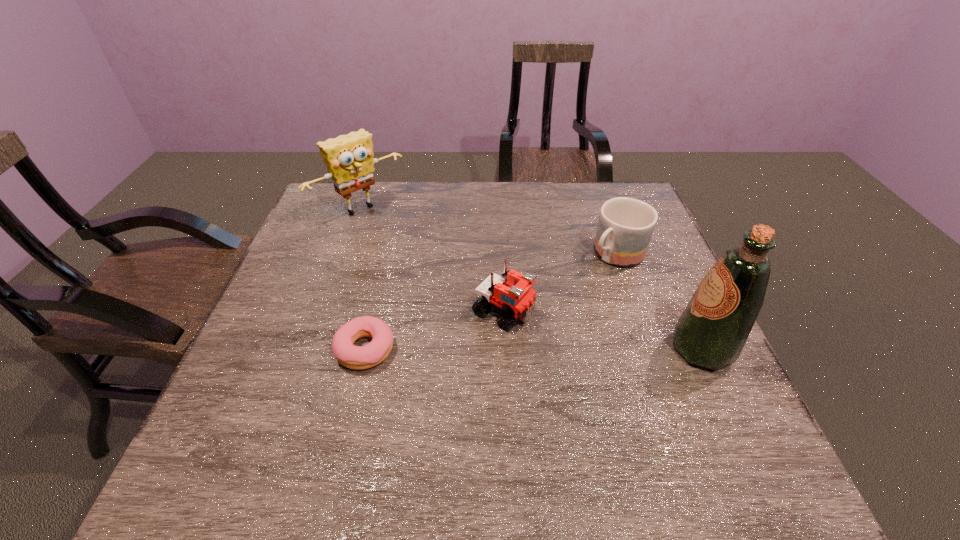
Locate an element on the screen. Image resolution: width=960 pixels, height=540 pixels. doughnut is located at coordinates (354, 357).

Locate an element on the screen. The image size is (960, 540). the tallest object is located at coordinates (711, 332).

Where is `sponge`? sponge is located at coordinates (349, 159).

Image resolution: width=960 pixels, height=540 pixels. In order to click on the farthest object in this screenshot , I will do pyautogui.click(x=349, y=159).

Locate an element on the screen. Image resolution: width=960 pixels, height=540 pixels. mug is located at coordinates (625, 227).

Locate an element on the screen. Image resolution: width=960 pixels, height=540 pixels. the third object from left to right is located at coordinates (515, 302).

Locate an element on the screen. This screenshot has height=540, width=960. vacant space situated on the right of the doughnut is located at coordinates (436, 349).

Where is `free space located on the front-facing side of the olive oil`? free space located on the front-facing side of the olive oil is located at coordinates (527, 349).

Where is `free space located 0.270m on the front-facing side of the olive oil`? This screenshot has width=960, height=540. free space located 0.270m on the front-facing side of the olive oil is located at coordinates 550,349.

Where is `free space located 0.130m on the front-facing side of the olive oil`? The height and width of the screenshot is (540, 960). free space located 0.130m on the front-facing side of the olive oil is located at coordinates (612, 349).